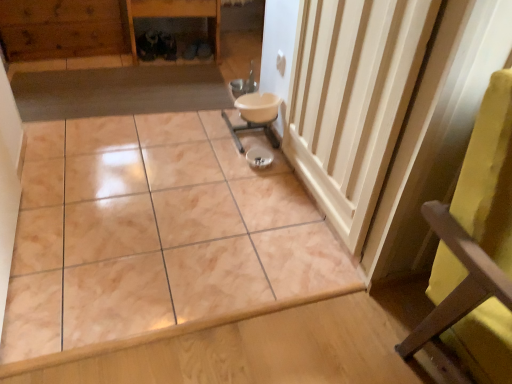
Question: Is marble tile at center bigger or smaller than wooden cabinet at upper left?

Choices:
 (A) big
 (B) small

Answer: (A)

Question: Does point (183, 279) appear closer or farther from the camera than point (4, 26)?

Choices:
 (A) closer
 (B) farther

Answer: (A)

Question: Which is farther from the white glossy sink at center?

Choices:
 (A) wooden cabinet at upper left
 (B) marble tile at center
 (C) white wood radiator at center right

Answer: (A)

Question: Which is farther from the wooden cabinet at upper left?

Choices:
 (A) white glossy sink at center
 (B) white wood radiator at center right
 (C) marble tile at center

Answer: (B)